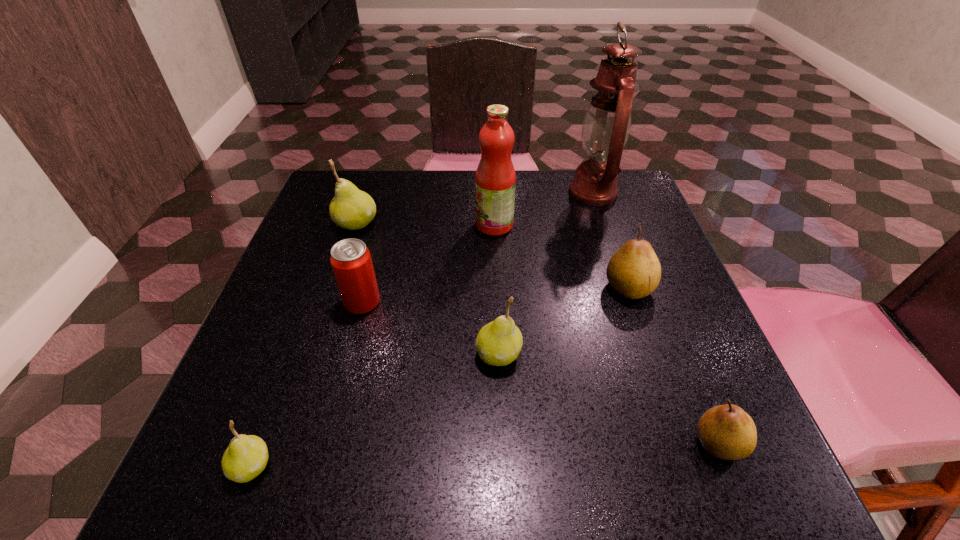
This screenshot has height=540, width=960. In order to click on free space located on the back of the sixth farthest object in this screenshot , I will do `click(494, 252)`.

Where is `vacant space situated 0.300m on the left of the smaller brown pear`? This screenshot has height=540, width=960. vacant space situated 0.300m on the left of the smaller brown pear is located at coordinates (490, 443).

I want to click on free space located on the right of the nearest green pear, so 414,466.

The image size is (960, 540). In order to click on oil lamp present at the far edge in this screenshot , I will do `click(606, 127)`.

This screenshot has height=540, width=960. I want to click on fruit juice located in the far edge section of the desktop, so click(x=495, y=180).

Locate an element on the screen. pear located in the far edge section of the desktop is located at coordinates (352, 209).

Identify the location of can present at the left edge. (351, 261).

You are a GUI agent. You are given a task and a screenshot of the screen. Output one action in this format:
    pyautogui.click(x=<x>, y=<y>)
    Task: Click on the oil lamp at the right edge
    This screenshot has width=960, height=540.
    Given the screenshot: What is the action you would take?
    pyautogui.click(x=606, y=127)

Locate an element on the screen. This screenshot has width=960, height=540. object that is positioned at the far left corner is located at coordinates (352, 209).

This screenshot has height=540, width=960. In order to click on object at the near left corner in this screenshot , I will do `click(246, 457)`.